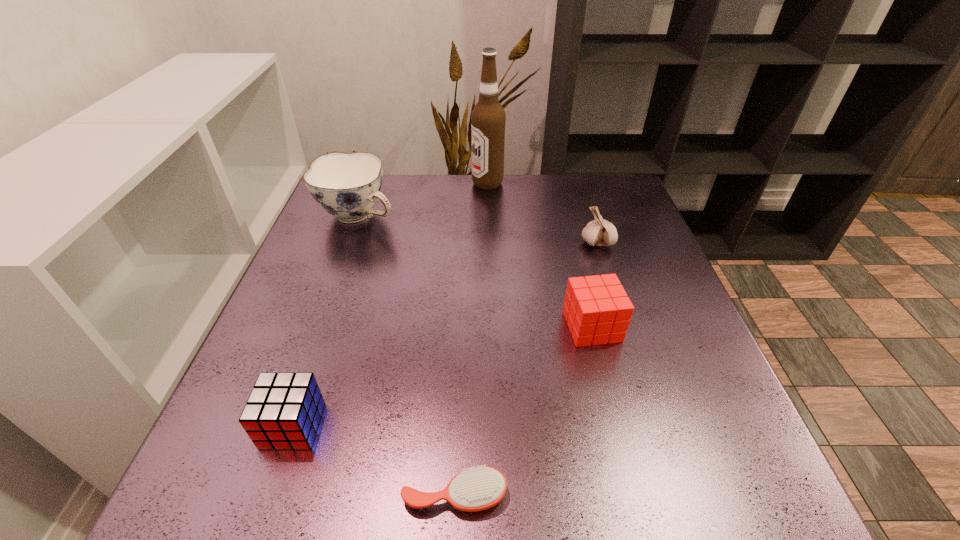
The image size is (960, 540). What are the coordinates of `object present at the near edge` in the screenshot? It's located at (479, 488).

Where is `chinaware positioned at the left edge`? The width and height of the screenshot is (960, 540). chinaware positioned at the left edge is located at coordinates [347, 186].

This screenshot has width=960, height=540. I want to click on cube that is positioned at the left edge, so click(x=283, y=411).

Identify the location of garlic present at the right edge. The height and width of the screenshot is (540, 960). (599, 232).

The image size is (960, 540). I want to click on cube located in the right edge section of the desktop, so click(597, 310).

You are a GUI agent. You are given a task and a screenshot of the screen. Output one action in this format:
    pyautogui.click(x=<x>, y=<y>)
    Task: Click on the object located at the far left corner
    The height and width of the screenshot is (540, 960).
    Given the screenshot: What is the action you would take?
    pyautogui.click(x=347, y=186)

In the image, there is a desktop. Where is `free space at the far edge`? The height and width of the screenshot is (540, 960). free space at the far edge is located at coordinates (537, 182).

The width and height of the screenshot is (960, 540). I want to click on free region at the left edge of the desktop, so tap(358, 253).

Where is `vacant space at the right edge`? vacant space at the right edge is located at coordinates (663, 427).

In the image, there is a desktop. At what (x,y) coordinates should I click in order to perform the action: click on vacant area at the far right corner. Please return your answer as a coordinate pair (x, y). This screenshot has height=540, width=960. Looking at the image, I should click on (576, 201).